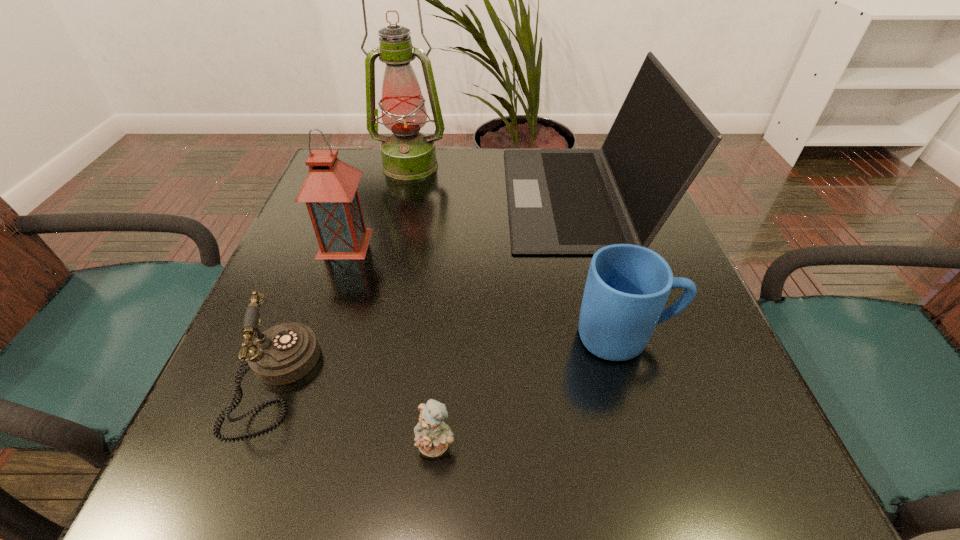
In order to click on empty space that is in between the telephone and the teddy bear in this screenshot , I will do [x=355, y=413].

Locate an element on the screen. free space that is in between the oil lamp and the laptop is located at coordinates (494, 181).

At what (x,y) coordinates should I click in order to perform the action: click on free space between the tallest object and the lantern. Please return your answer as a coordinate pair (x, y). Looking at the image, I should click on [x=377, y=204].

The height and width of the screenshot is (540, 960). Find the location of `free space that is in between the laptop and the lantern`. free space that is in between the laptop and the lantern is located at coordinates (462, 220).

The width and height of the screenshot is (960, 540). Identify the location of free space between the fourth tallest object and the telephone. (449, 359).

Identify the location of vacant point located between the oil lamp and the shortest object. The height and width of the screenshot is (540, 960). (423, 305).

Where is `unoccupied area between the laptop and the lantern`? unoccupied area between the laptop and the lantern is located at coordinates (462, 220).

You are a GUI agent. You are given a task and a screenshot of the screen. Output one action in this format:
    pyautogui.click(x=<x>, y=<y>)
    Task: Click on the free space between the fourth tallest object and the telephone
    This screenshot has height=540, width=960.
    Given the screenshot: What is the action you would take?
    pyautogui.click(x=449, y=359)

The width and height of the screenshot is (960, 540). In order to click on the fifth closest object to the lantern in this screenshot , I will do `click(627, 286)`.

Identify the location of object that is the fifth closest to the oil lamp. (432, 435).